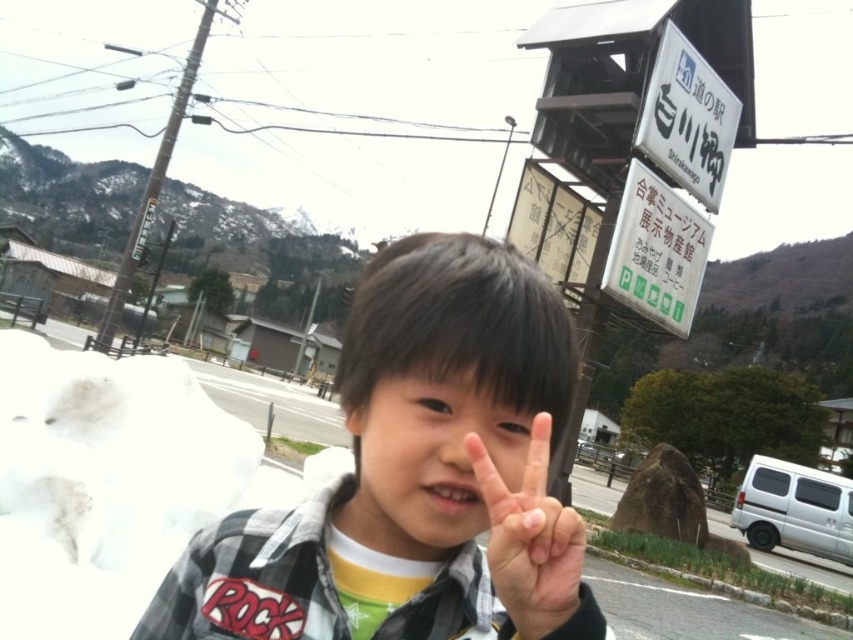
Question: Which point is farther from the camera taking this photo?

Choices:
 (A) (492, 496)
 (B) (387, 340)
 (C) (641, 166)

Answer: (C)

Question: Does plaid shirt at center have a lesser width compared to smooth skin hand at center?

Choices:
 (A) yes
 (B) no

Answer: (B)

Question: In this image, where is smooth skin hand at center located relative to white plastic sign at upper right?

Choices:
 (A) right
 (B) left

Answer: (B)

Question: Can you confirm if plaid shirt at center is thinner than white plastic sign at upper center?

Choices:
 (A) no
 (B) yes

Answer: (B)

Question: Which object appears farthest from the camera in this image?

Choices:
 (A) plaid shirt at center
 (B) white plastic sign at upper right

Answer: (B)

Question: Which point is closer to the camera taking this photo?

Choices:
 (A) (514, 592)
 (B) (677, 115)
 (C) (700, 276)
 (D) (177, 632)

Answer: (A)